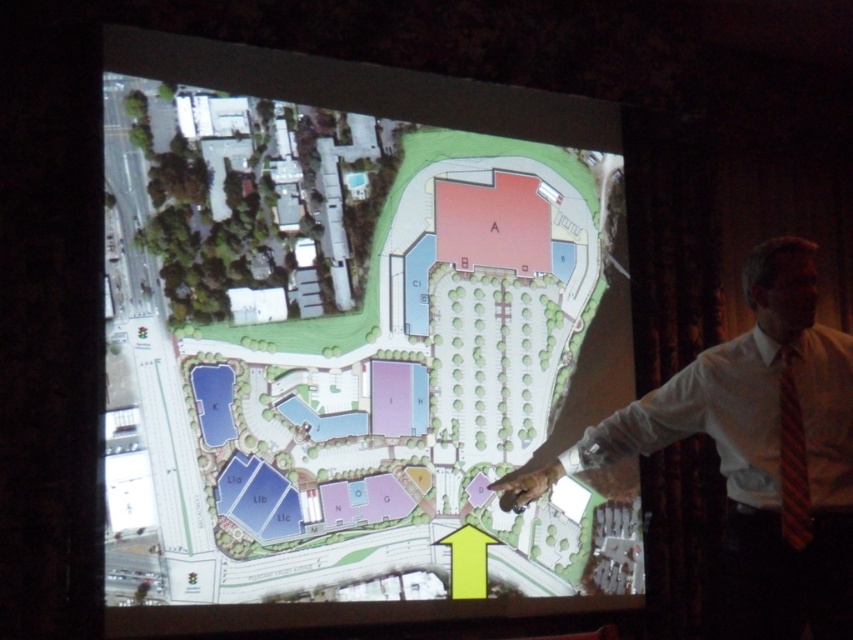
You are attending a presentation and see the slide displayed. There is a white satin dress shirt at center located at point (705, 419). Where on the slide is the white satin dress shirt at center positioned?

The white satin dress shirt at center is positioned at point (705, 419) on the slide.

You are an attendee at a presentation and notice the green grass at bottom and the brown striped tie at right in the slide. Which object is located higher on the slide?

The green grass at bottom is above the brown striped tie at right, so the green grass at bottom is higher on the slide.

You are an attendee at a presentation and notice the green grass at bottom and the brown striped tie at right in the projected slide. Which of these two items appears bigger on the slide?

The green grass at bottom has a larger size compared to brown striped tie at right, so the green grass at bottom appears bigger on the slide.